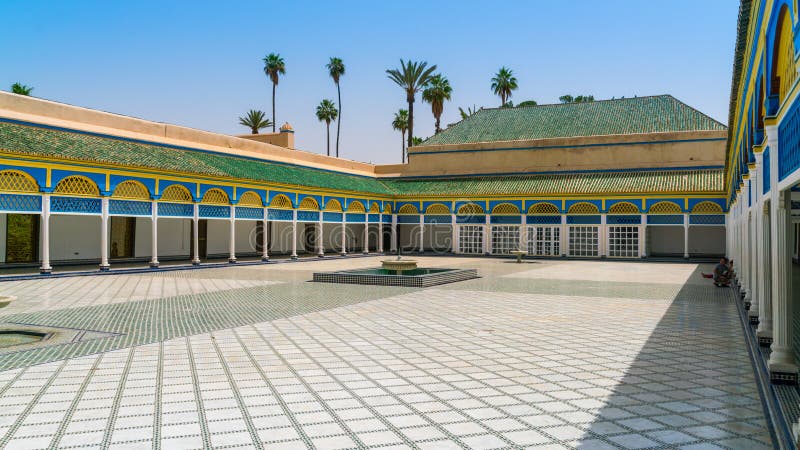
Where is `tile`? This screenshot has width=800, height=450. tile is located at coordinates click(498, 423).